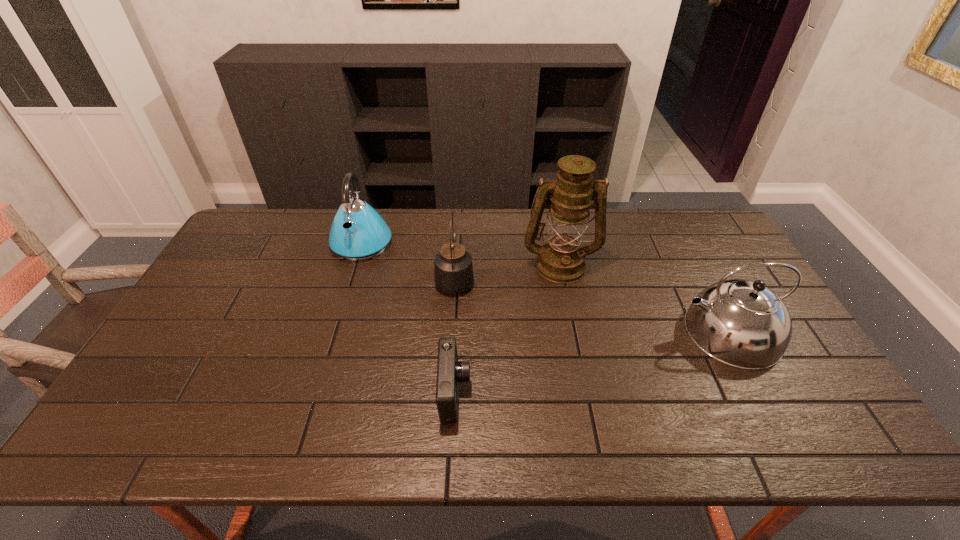
Where is `unoccupied position between the second kettle from left to right and the nearest kettle`? unoccupied position between the second kettle from left to right and the nearest kettle is located at coordinates (591, 305).

Locate an element on the screen. vacant area that lies between the camera and the second kettle from left to right is located at coordinates (455, 336).

Locate an element on the screen. free point between the second kettle from left to right and the leftmost kettle is located at coordinates (408, 261).

Locate which object ranks fourth in proximity to the second kettle from left to right. Please provide its 2D coordinates. Your answer should be formatted as a tuple, i.e. [(x, y)], where the tuple contains the x and y coordinates of a point satisfying the conditions above.

[(741, 323)]

Where is `the second closest object relative to the camera`? the second closest object relative to the camera is located at coordinates (562, 260).

Identify which kettle is the closest to the leftmost object. Please provide its 2D coordinates. Your answer should be formatted as a tuple, i.e. [(x, y)], where the tuple contains the x and y coordinates of a point satisfying the conditions above.

[(453, 271)]

Identify which kettle is the closest to the nearest kettle. Please provide its 2D coordinates. Your answer should be formatted as a tuple, i.e. [(x, y)], where the tuple contains the x and y coordinates of a point satisfying the conditions above.

[(453, 271)]

The image size is (960, 540). In order to click on free spot that satisfies the following two spatial constraints: 1. on the front side of the tallest object; 2. on the front-facing side of the camera in this screenshot , I will do `click(586, 393)`.

Where is `free space that satisfies the following two spatial constraints: 1. spout on the second object from right to left; 2. on the right side of the second kettle from right to left`? This screenshot has width=960, height=540. free space that satisfies the following two spatial constraints: 1. spout on the second object from right to left; 2. on the right side of the second kettle from right to left is located at coordinates (455, 264).

What are the coordinates of `vacant space that satisfies the following two spatial constraints: 1. spout on the second kettle from right to left; 2. on the right side of the tallest object` in the screenshot? It's located at (x=455, y=264).